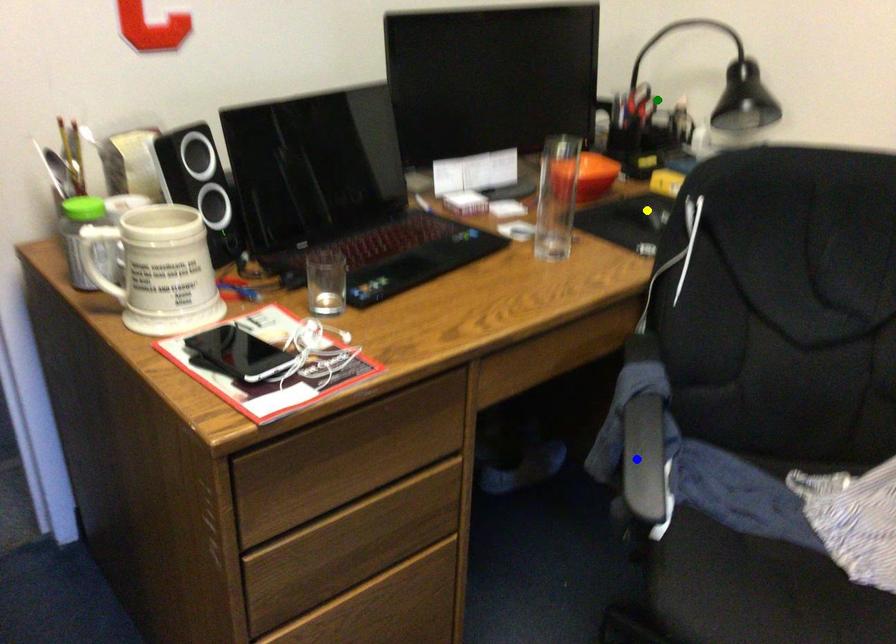
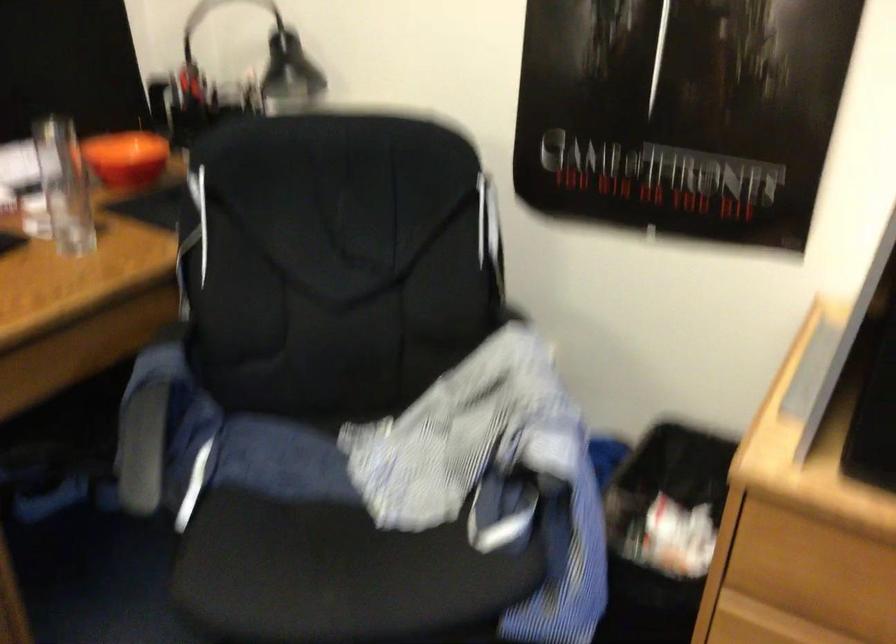
I am providing you with two images of the same scene from different viewpoints. Three points are marked in image1. Which point corresponds to a part or object that is occluded in image2?In image1, three points are marked. Which of them correspond to a part or object that is occluded in image2?Among the three points shown in image1, which one corresponds to a part or object that is no longer visible due to occlusion in image2?

Invisible in image2: yellow point.